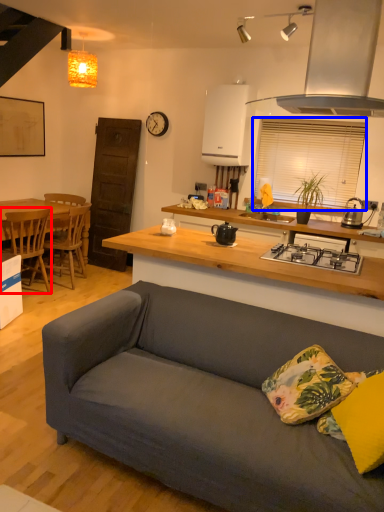
Question: Which point is further to the camera, chair (highlighted by a red box) or window screen (highlighted by a blue box)?

Choices:
 (A) chair
 (B) window screen

Answer: (B)